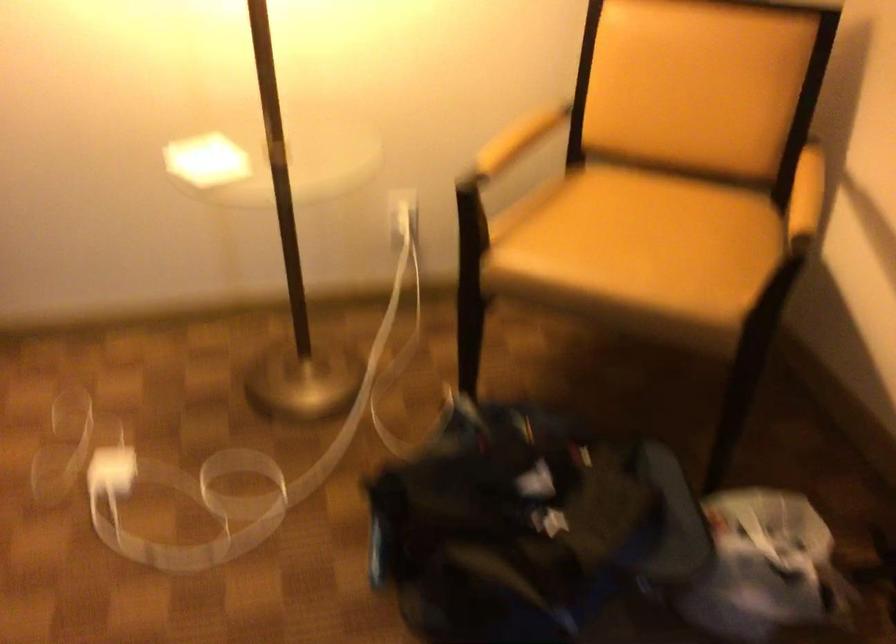
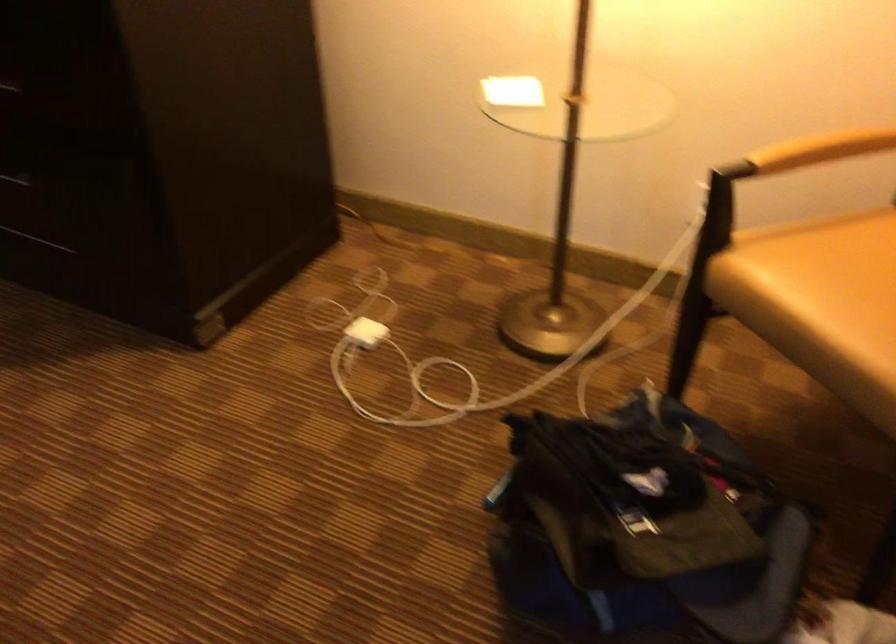
Where in the second image is the point corresponding to point (115, 471) from the first image?

(366, 332)